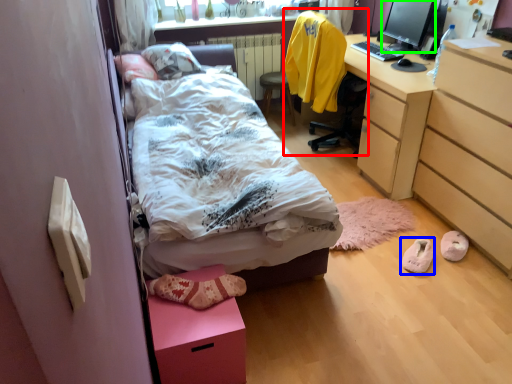
Question: Considering the real-world distances, which object is farthest from chair (highlighted by a red box)? footwear (highlighted by a blue box) or computer monitor (highlighted by a green box)?

Choices:
 (A) footwear
 (B) computer monitor

Answer: (A)